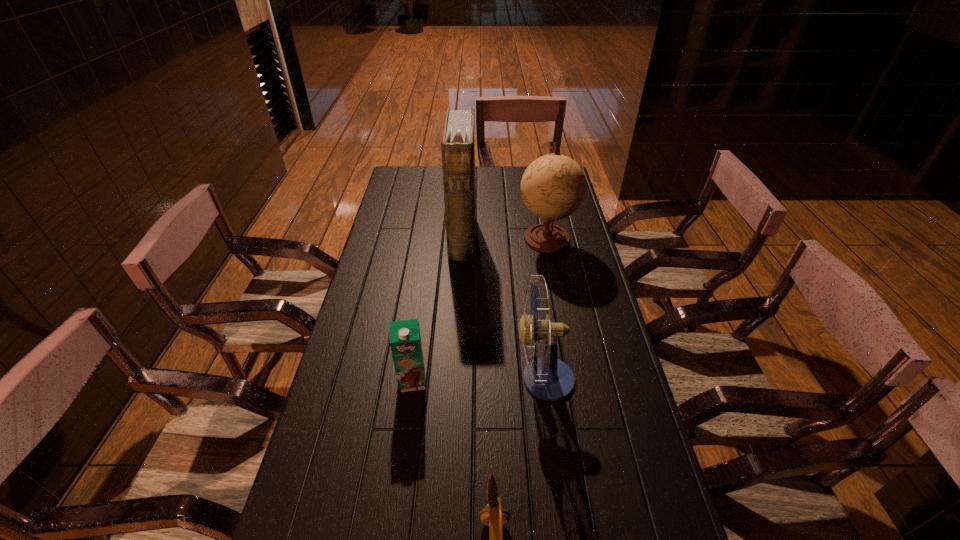
Where is `free space located 0.350m on the back of the leftmost object`? Image resolution: width=960 pixels, height=540 pixels. free space located 0.350m on the back of the leftmost object is located at coordinates point(425,285).

The width and height of the screenshot is (960, 540). What are the coordinates of `globe that is at the right edge` in the screenshot? It's located at (553, 187).

This screenshot has height=540, width=960. What are the coordinates of `fan situated at the right edge` in the screenshot? It's located at (548, 378).

This screenshot has width=960, height=540. What are the coordinates of `vacant space at the far edge of the desktop` in the screenshot? It's located at (479, 190).

Image resolution: width=960 pixels, height=540 pixels. Find the location of `vacant space at the left edge of the desktop`. vacant space at the left edge of the desktop is located at coordinates (339, 359).

Find the location of a particular element. free region at the right edge of the desktop is located at coordinates (603, 360).

At what (x,y) coordinates should I click in order to perform the action: click on vacant space at the far left corner of the desktop. Please return your answer as a coordinate pair (x, y). Looking at the image, I should click on (420, 183).

The image size is (960, 540). I want to click on free space that is in between the carton and the fan, so click(478, 380).

At what (x,y) coordinates should I click in order to perform the action: click on vacant region between the tallest object and the leftmost object. Please return your answer as a coordinate pair (x, y). Looking at the image, I should click on (438, 309).

Locate an element on the screen. Image resolution: width=960 pixels, height=540 pixels. empty location between the second object from left to right and the fan is located at coordinates (503, 309).